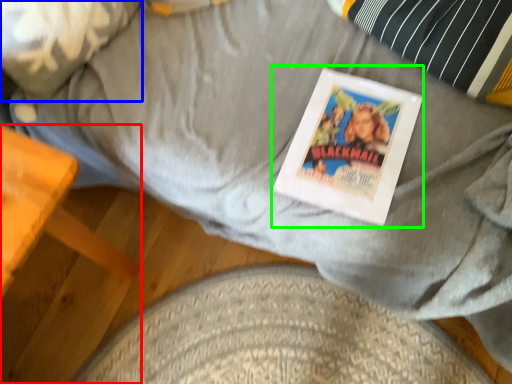
Question: Which object is the farthest from furniture (highlighted by a red box)? Choose among these: pillow (highlighted by a blue box) or magazine (highlighted by a green box).

Choices:
 (A) pillow
 (B) magazine

Answer: (B)